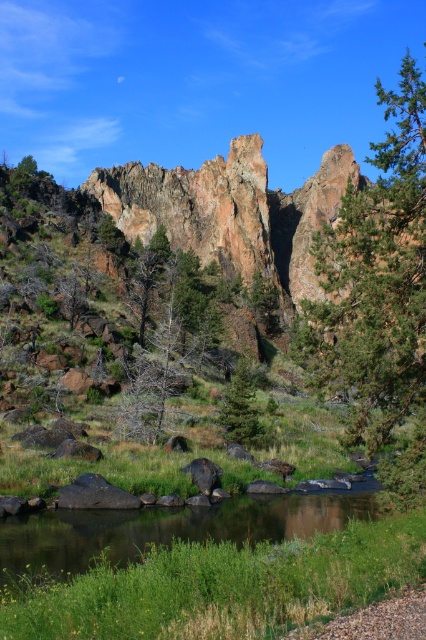
Question: Among these objects, which one is nearest to the camera?

Choices:
 (A) green matte tree at center
 (B) smooth gray rock at center
 (C) green grassy stream at lower center

Answer: (C)

Question: Estimate the real-world distances between objects in this image. Which object is closer to the smooth gray rock at lower left?

Choices:
 (A) green textured tree at right
 (B) smooth gray rock at center
 (C) green grassy stream at lower center

Answer: (B)

Question: Is brown/dry wood tree at center thinner than smooth gray rock at center?

Choices:
 (A) yes
 (B) no

Answer: (B)

Question: Where is green textured tree at right located in relation to smooth gray rock at center in the image?

Choices:
 (A) left
 (B) right

Answer: (B)

Question: From the image, what is the correct spatial relationship of green grassy stream at lower center in relation to smooth gray rock at lower left?

Choices:
 (A) above
 (B) below

Answer: (B)

Question: Considering the real-world distances, which object is farthest from the green matte tree at center?

Choices:
 (A) brown/dry wood tree at center
 (B) smooth gray rock at lower left
 (C) green textured tree at right
 (D) smooth gray rock at center

Answer: (C)